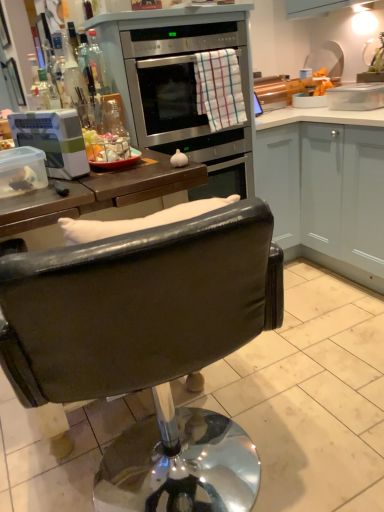
This screenshot has height=512, width=384. I want to click on black leather chair at center, so click(149, 346).

Find the location of a particular element. This screenshot has height=512, width=384. stainless steel oven at upper center is located at coordinates (180, 88).

This screenshot has height=512, width=384. What are the coordinates of `metallic silver pot/pan at upper right` in the screenshot? It's located at (356, 97).

This screenshot has width=384, height=512. What are the coordinates of `white matte cabinet at right` in the screenshot? It's located at (326, 195).

Which point is more distant from viewer, (106, 88) or (77, 119)?

Positioned behind is point (106, 88).

Considering the positions of objects clear glass bottle at upper left and white plastic container at left in the image provided, who is more to the right, clear glass bottle at upper left or white plastic container at left?

clear glass bottle at upper left is more to the right.

Can we say clear glass bottle at upper left lies outside white plastic container at left?

clear glass bottle at upper left lies outside white plastic container at left's area.

Consider the image. Is the depth of clear glass bottle at upper left greater than that of white plastic container at left?

Yes, it is.

Which object is positioned more to the left, metallic silver pot/pan at upper right or stainless steel oven at upper center?

stainless steel oven at upper center is more to the left.

Is there a large distance between metallic silver pot/pan at upper right and stainless steel oven at upper center?

No, there isn't a large distance between metallic silver pot/pan at upper right and stainless steel oven at upper center.

Can you confirm if metallic silver pot/pan at upper right is smaller than stainless steel oven at upper center?

Indeed, metallic silver pot/pan at upper right has a smaller size compared to stainless steel oven at upper center.

From a real-world perspective, which is physically above, metallic silver pot/pan at upper right or stainless steel oven at upper center?

stainless steel oven at upper center.

Considering the positions of objects checkered cotton towel at center and white plastic container at left in the image provided, who is in front, checkered cotton towel at center or white plastic container at left?

white plastic container at left is more forward.

From a real-world perspective, which is physically below, checkered cotton towel at center or white plastic container at left?

white plastic container at left.

From the image's perspective, is checkered cotton towel at center positioned above or below white plastic container at left?

checkered cotton towel at center is situated higher than white plastic container at left in the image.

You are a GUI agent. You are given a task and a screenshot of the screen. Output one action in this format:
    pyautogui.click(x=<x>, y=<y>)
    Task: Click on the towel/napkin above the white plastic container at left (from a real-world perspective)
    The height and width of the screenshot is (512, 384).
    Given the screenshot: What is the action you would take?
    pyautogui.click(x=219, y=88)

Is clear glass bottle at upper left taller than checkered cotton towel at center?

In fact, clear glass bottle at upper left may be shorter than checkered cotton towel at center.

This screenshot has height=512, width=384. I want to click on bottle that appears on the left of checkered cotton towel at center, so click(97, 64).

Considering the positions of objects clear glass bottle at upper left and checkered cotton towel at center in the image provided, who is more to the left, clear glass bottle at upper left or checkered cotton towel at center?

clear glass bottle at upper left is more to the left.

Does clear glass bottle at upper left lie in front of checkered cotton towel at center?

Yes, it is in front of checkered cotton towel at center.

Considering the sizes of objects white matte cabinet at right and metallic silver pot/pan at upper right in the image provided, who is taller, white matte cabinet at right or metallic silver pot/pan at upper right?

With more height is white matte cabinet at right.

In terms of size, does white matte cabinet at right appear bigger or smaller than metallic silver pot/pan at upper right?

In the image, white matte cabinet at right appears to be larger than metallic silver pot/pan at upper right.

Which is nearer, (381, 288) or (345, 95)?

Point (381, 288)

Is the surface of white matte cabinet at right in direct contact with metallic silver pot/pan at upper right?

white matte cabinet at right and metallic silver pot/pan at upper right are clearly separated.

Based on the photo, could you tell me if clear glass bottle at upper left is facing metallic silver pot/pan at upper right?

No, clear glass bottle at upper left is not turned towards metallic silver pot/pan at upper right.

Is clear glass bottle at upper left to the left of metallic silver pot/pan at upper right from the viewer's perspective?

Indeed, clear glass bottle at upper left is positioned on the left side of metallic silver pot/pan at upper right.

Are clear glass bottle at upper left and metallic silver pot/pan at upper right far apart?

clear glass bottle at upper left is positioned a significant distance from metallic silver pot/pan at upper right.

Considering the sizes of objects clear glass bottle at upper left and metallic silver pot/pan at upper right in the image provided, who is thinner, clear glass bottle at upper left or metallic silver pot/pan at upper right?

clear glass bottle at upper left.

Can you confirm if white plastic container at left is shorter than black leather chair at center?

Correct, white plastic container at left is not as tall as black leather chair at center.

Locate an element on the screen. kitchen appliance that appears above the black leather chair at center (from a real-world perspective) is located at coordinates (53, 140).

Is white plastic container at left not close to black leather chair at center?

No, white plastic container at left is in close proximity to black leather chair at center.

You are a GUI agent. You are given a task and a screenshot of the screen. Output one action in this format:
    pyautogui.click(x=<x>, y=<y>)
    Task: Click on the kitchen appliance in front of the clear glass bottle at upper left
    This screenshot has width=384, height=512.
    Given the screenshot: What is the action you would take?
    pyautogui.click(x=53, y=140)

This screenshot has height=512, width=384. In order to click on appliance located below the metallic silver pot/pan at upper right (from the image's perspective) in this screenshot , I will do `click(180, 88)`.

Which object lies nearer to the anchor point clear glass bottle at upper left, white matte cabinet at right or checkered cotton towel at center?

Among the two, checkered cotton towel at center is located nearer to clear glass bottle at upper left.

In the scene shown: Estimate the real-world distances between objects in this image. Which object is further from black leather chair at center, metallic silver pot/pan at upper right or clear glass bottle at upper left?

metallic silver pot/pan at upper right lies further to black leather chair at center than the other object.

When comparing their distances from clear glass bottle at upper left, does checkered cotton towel at center or black leather chair at center seem further?

black leather chair at center is positioned further to the anchor clear glass bottle at upper left.

Which object lies nearer to the anchor point black leather chair at center, white plastic container at left or white matte cabinet at right?

white plastic container at left.

Considering their positions, is black leather chair at center positioned closer to stainless steel oven at upper center than checkered cotton towel at center?

checkered cotton towel at center.

From the image, which object appears to be nearer to white plastic container at left, white matte cabinet at right or stainless steel oven at upper center?

stainless steel oven at upper center is closer to white plastic container at left.

From the image, which object appears to be nearer to white plastic container at left, stainless steel oven at upper center or clear glass bottle at upper left?

Based on the image, clear glass bottle at upper left appears to be nearer to white plastic container at left.

Estimate the real-world distances between objects in this image. Which object is closer to metallic silver pot/pan at upper right, white matte cabinet at right or black leather chair at center?

Based on the image, white matte cabinet at right appears to be nearer to metallic silver pot/pan at upper right.

Identify the location of towel/napkin situated between clear glass bottle at upper left and metallic silver pot/pan at upper right from left to right. This screenshot has height=512, width=384. (219, 88).

Where is `appliance located between clear glass bottle at upper left and white matte cabinet at right in the left-right direction`? appliance located between clear glass bottle at upper left and white matte cabinet at right in the left-right direction is located at coordinates (180, 88).

This screenshot has width=384, height=512. Identify the location of appliance between white plastic container at left and metallic silver pot/pan at upper right. (180, 88).

Where is `towel/napkin between stainless steel oven at upper center and white matte cabinet at right in the horizontal direction`? The width and height of the screenshot is (384, 512). towel/napkin between stainless steel oven at upper center and white matte cabinet at right in the horizontal direction is located at coordinates (219, 88).